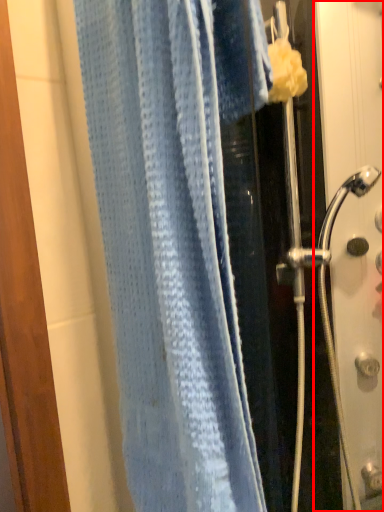
Question: From the image's perspective, where is screen door (annotated by the red box) located relative to towel?

Choices:
 (A) above
 (B) below

Answer: (B)